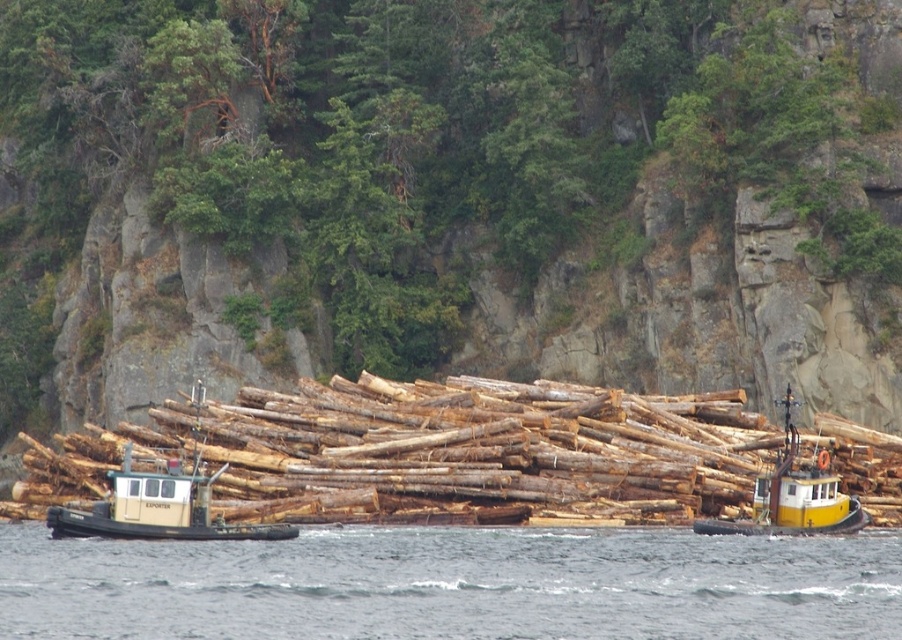
You are a photographer trying to capture the raft of logs from a safe distance. The raft is located at point (143, 506). What is the minimum distance you need to maintain to ensure the raft is fully in frame?

The minimum distance you need to maintain is 74.31 meters to ensure the raft of logs at point (143, 506) is fully in frame.

You are a photographer standing at the camera position. You want to take a photo of the green leafy tree at center. If your camera has a maximum focus range of 90 meters, will you be able to focus on the tree?

The distance between the green leafy tree at center and the camera is 91.55 meters, which exceeds the camera maximum focus range of 90 meters. Therefore, the camera cannot focus on the tree.